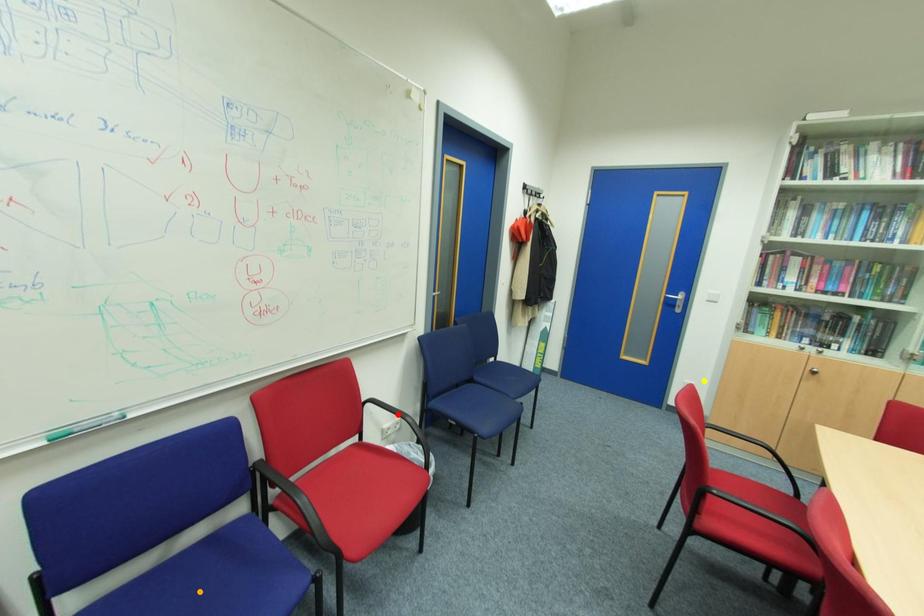
Order these from nearest to farthest:
- orange point
- yellow point
- red point

orange point → red point → yellow point